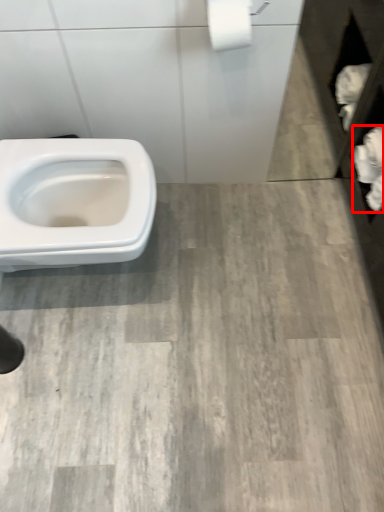
Question: Considering the relative positions of toilet paper (annotated by the red box) and toilet paper in the image provided, where is toilet paper (annotated by the red box) located with respect to the staircase?

Choices:
 (A) right
 (B) left

Answer: (A)